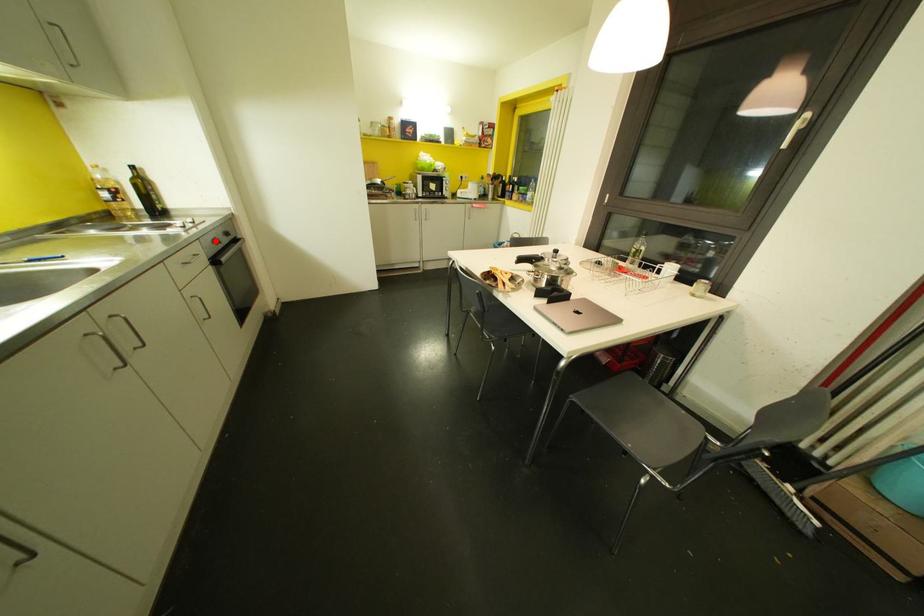
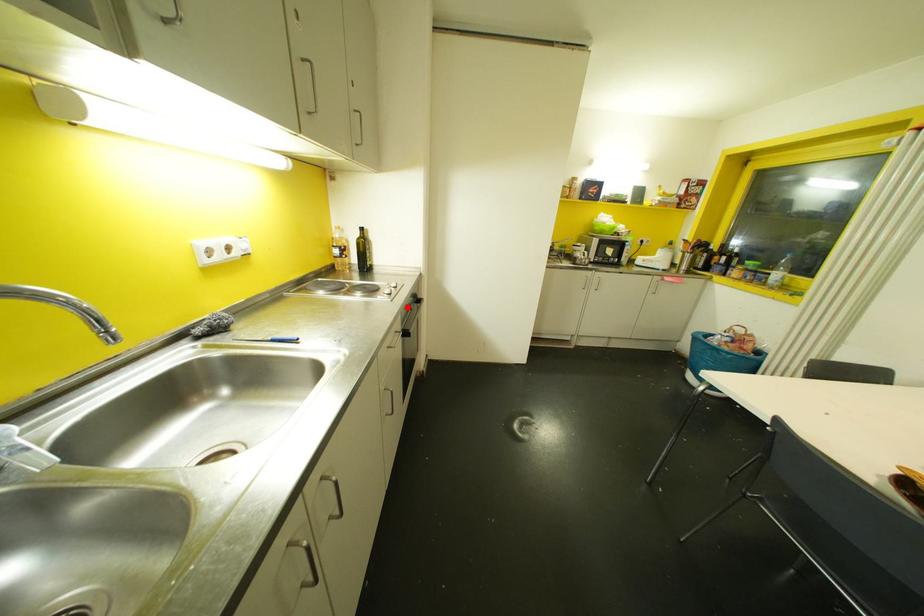
I am providing you with two images of the same scene from different viewpoints. A red point is marked on the first image and another point is marked on the second image. Is the red point in image1 aligned with the point shown in image2?

Yes